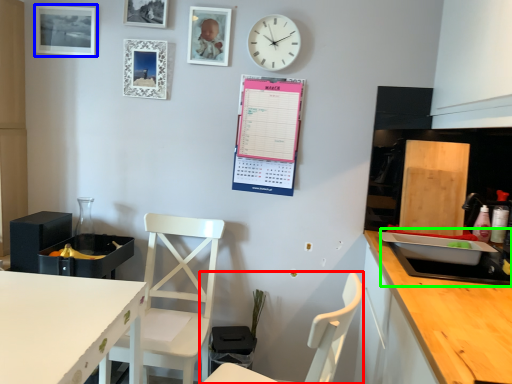
Question: Which object is positioned closest to chair (highlighted by a red box)? Select from picture frame (highlighted by a blue box) and sink (highlighted by a green box).

Choices:
 (A) picture frame
 (B) sink

Answer: (B)